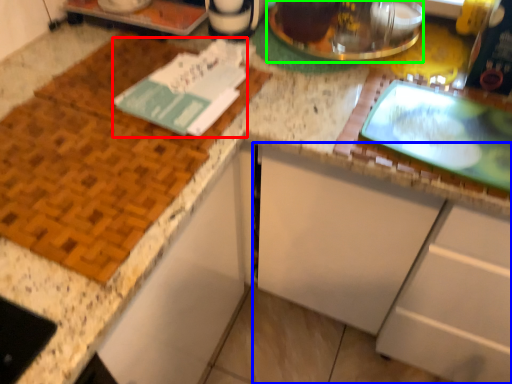
Question: Which object is the closest to the journal (highlighted by a red box)? Choose among these: cabinetry (highlighted by a blue box) or appliance (highlighted by a green box).

Choices:
 (A) cabinetry
 (B) appliance

Answer: (B)